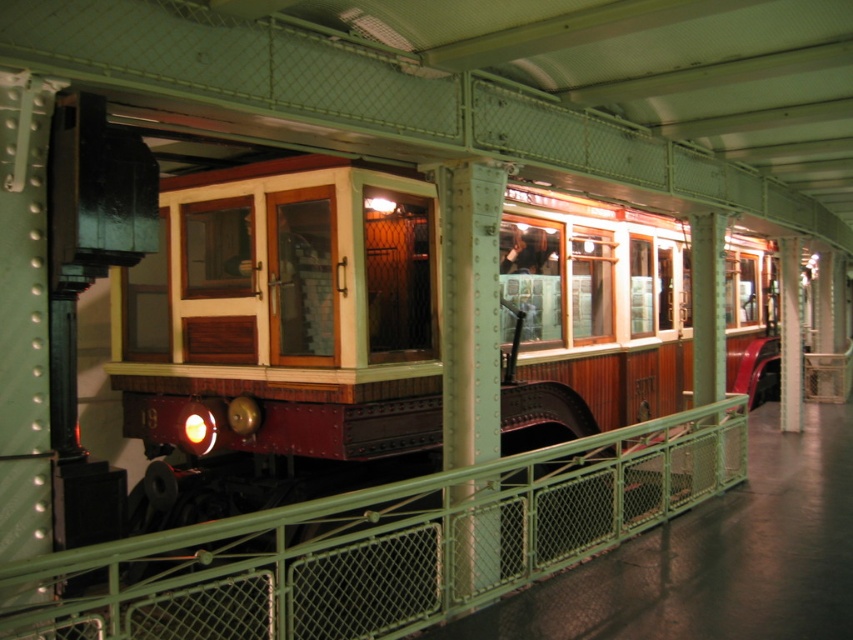
Question: Does wooden paneling train at center appear on the right side of green metal fence at center?

Choices:
 (A) yes
 (B) no

Answer: (B)

Question: Which point is closer to the camera?

Choices:
 (A) (590, 337)
 (B) (79, 566)

Answer: (B)

Question: Among these points, which one is farthest from the camera?

Choices:
 (A) (32, 609)
 (B) (422, 305)

Answer: (B)

Question: Is wooden paneling train at center wider than green metal fence at center?

Choices:
 (A) yes
 (B) no

Answer: (B)

Question: Does wooden paneling train at center have a larger size compared to green metal fence at center?

Choices:
 (A) no
 (B) yes

Answer: (A)